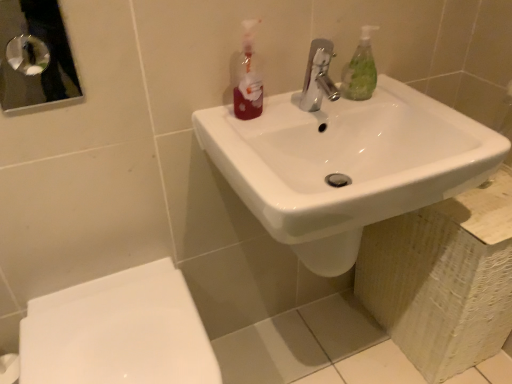
Identify the location of free space between polished chrome faucet at center and green translucent soap dispenser at upper right. (337, 105).